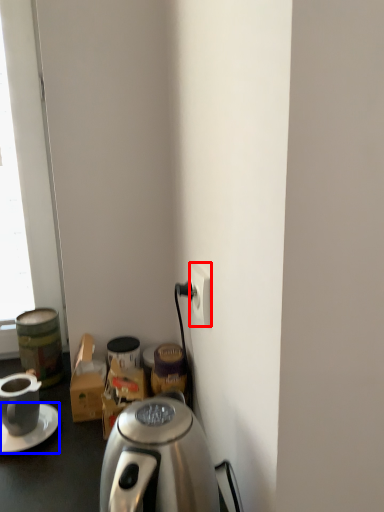
Question: Which object is closer to the camera taking this photo, power outlet (highlighted by a red box) or saucer (highlighted by a blue box)?

Choices:
 (A) power outlet
 (B) saucer

Answer: (A)